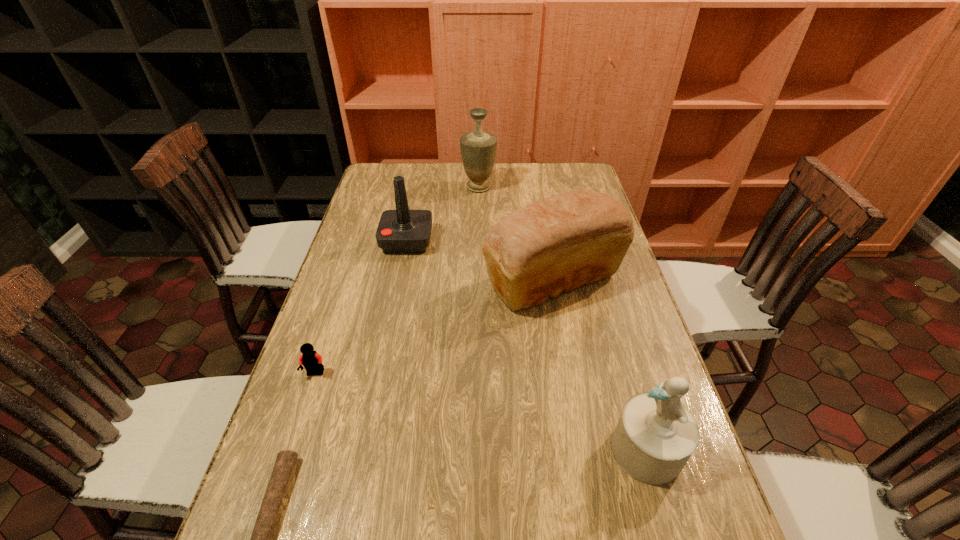
Locate an element on the screen. vacant space at the right edge of the desktop is located at coordinates (612, 357).

Image resolution: width=960 pixels, height=540 pixels. I want to click on free space at the far left corner of the desktop, so click(x=375, y=169).

I want to click on free space between the third object from left to right and the fifth tallest object, so click(361, 307).

Image resolution: width=960 pixels, height=540 pixels. I want to click on blank region between the figurine and the third object from left to right, so click(527, 346).

At what (x,y) coordinates should I click in order to perform the action: click on empty space between the fourth object from right to left and the figurine. Please return your answer as a coordinate pair (x, y). Image resolution: width=960 pixels, height=540 pixels. Looking at the image, I should click on (527, 346).

Locate an element on the screen. The width and height of the screenshot is (960, 540). free spot between the urn and the fifth tallest object is located at coordinates pyautogui.click(x=397, y=280).

Where is `free space between the figurine and the urn`? Image resolution: width=960 pixels, height=540 pixels. free space between the figurine and the urn is located at coordinates pos(563,319).

The width and height of the screenshot is (960, 540). What are the coordinates of `empty space that is in between the fourth object from right to left and the Lego` in the screenshot? It's located at (361, 307).

Where is `free space between the second shortest object and the joystick`? This screenshot has width=960, height=540. free space between the second shortest object and the joystick is located at coordinates (361, 307).

Identify which object is located as the third nearest to the bread. Please provide its 2D coordinates. Your answer should be formatted as a tuple, i.e. [(x, y)], where the tuple contains the x and y coordinates of a point satisfying the conditions above.

[(478, 148)]